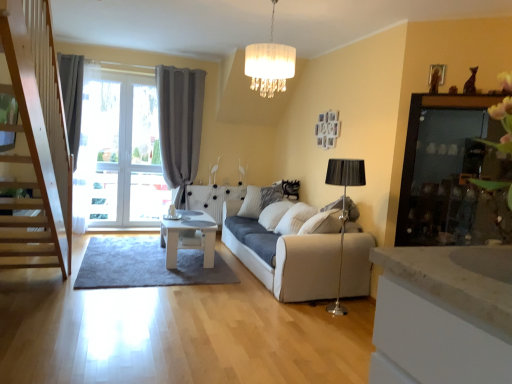
Question: Can you confirm if white fabric studio couch at center is bigger than white textured pillow at center?

Choices:
 (A) no
 (B) yes

Answer: (B)

Question: Is white fabric studio couch at center not within white textured pillow at center?

Choices:
 (A) no
 (B) yes

Answer: (B)

Question: From a real-world perspective, is white fabric studio couch at center located higher than white textured pillow at center?

Choices:
 (A) no
 (B) yes

Answer: (A)

Question: From the image's perspective, is white fabric studio couch at center above white textured pillow at center?

Choices:
 (A) no
 (B) yes

Answer: (A)

Question: Is the position of white fabric studio couch at center more distant than that of white textured pillow at center?

Choices:
 (A) no
 (B) yes

Answer: (A)

Question: From their relative heights in the image, would you say white textured pillow at center is taller or shorter than white fabric studio couch at center?

Choices:
 (A) tall
 (B) short

Answer: (B)

Question: Looking at the image, does white textured pillow at center seem bigger or smaller compared to white fabric studio couch at center?

Choices:
 (A) big
 (B) small

Answer: (B)

Question: From a real-world perspective, relative to white fabric studio couch at center, is white textured pillow at center vertically above or below?

Choices:
 (A) below
 (B) above

Answer: (B)

Question: From the image's perspective, is white textured pillow at center positioned above or below white fabric studio couch at center?

Choices:
 (A) above
 (B) below

Answer: (A)

Question: In terms of height, does white fabric chandelier at upper center look taller or shorter compared to gray fabric curtain at left?

Choices:
 (A) short
 (B) tall

Answer: (A)

Question: Is white fabric chandelier at upper center situated inside gray fabric curtain at left or outside?

Choices:
 (A) inside
 (B) outside

Answer: (B)

Question: Is white fabric chandelier at upper center in front of or behind gray fabric curtain at left in the image?

Choices:
 (A) behind
 (B) front

Answer: (B)

Question: Is white fabric chandelier at upper center bigger or smaller than gray fabric curtain at left?

Choices:
 (A) small
 (B) big

Answer: (A)

Question: Does point (210, 233) appear closer or farther from the camera than point (196, 150)?

Choices:
 (A) closer
 (B) farther

Answer: (A)

Question: From a real-world perspective, is white glossy table at center above or below gray fabric curtain at left?

Choices:
 (A) above
 (B) below

Answer: (B)